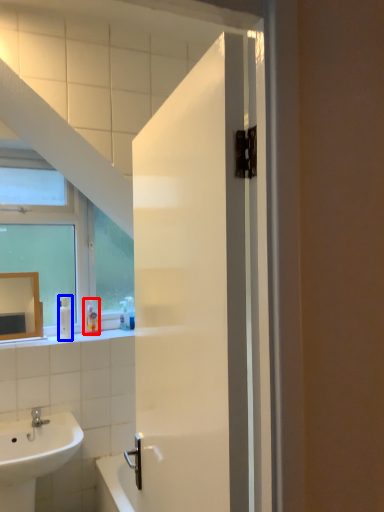
Question: Which of the following is the farthest to the observer, toiletry (highlighted by a red box) or soap dispenser (highlighted by a blue box)?

Choices:
 (A) toiletry
 (B) soap dispenser

Answer: (A)